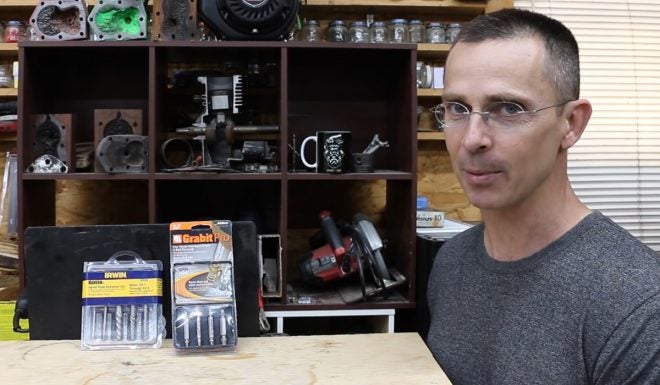
Find the location of a particular element. This screenshot has height=385, width=660. fish shaped containers is located at coordinates (111, 19), (49, 15).